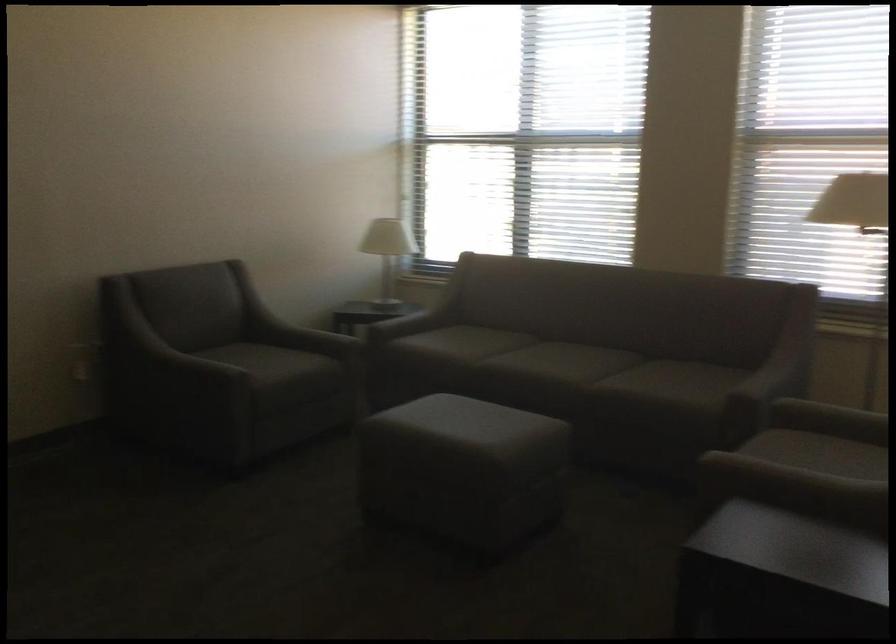
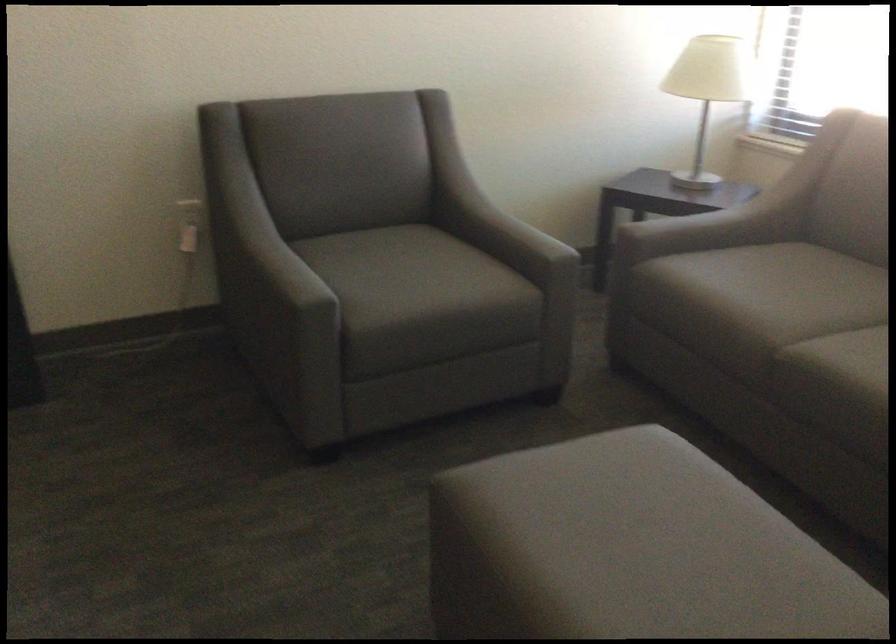
In the second image, find the point that corresponds to [355,327] in the first image.

(643, 214)